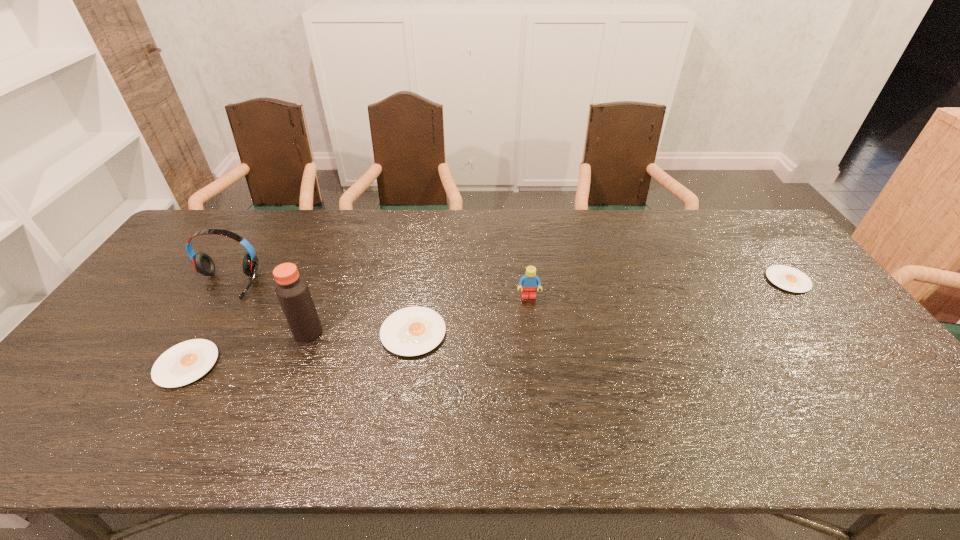
Image resolution: width=960 pixels, height=540 pixels. What are the coordinates of `free space between the fifth tallest object and the headset` in the screenshot? It's located at (206, 324).

This screenshot has width=960, height=540. I want to click on vacant area between the second egg yolk from left to right and the fourth shortest object, so click(x=471, y=315).

Identify the location of free area in between the second tallest object and the second object from right to left. Image resolution: width=960 pixels, height=540 pixels. click(377, 290).

This screenshot has height=540, width=960. Find the location of `the closest object to the fifth tallest object`. the closest object to the fifth tallest object is located at coordinates (202, 262).

Identify which object is located as the nearest to the third object from left to right. Please provide its 2D coordinates. Your answer should be formatted as a tuple, i.e. [(x, y)], where the tuple contains the x and y coordinates of a point satisfying the conditions above.

[(411, 331)]

This screenshot has height=540, width=960. I want to click on egg yolk that is the closest to the leftmost egg yolk, so click(x=411, y=331).

Identify the location of the closest egg yolk to the headset. 184,363.

This screenshot has width=960, height=540. Find the location of `vacant position in the image that satisfies the following two spatial constraints: 1. with the microphone attached to the side of the second tallest object; 2. on the right side of the second egg yolk from right to left`. vacant position in the image that satisfies the following two spatial constraints: 1. with the microphone attached to the side of the second tallest object; 2. on the right side of the second egg yolk from right to left is located at coordinates (196, 333).

Identify the location of vacant space that satisfies the following two spatial constraints: 1. on the back side of the shortest object; 2. on the left side of the second shortest object. (238, 280).